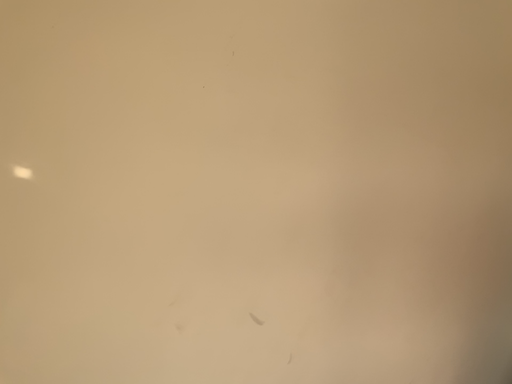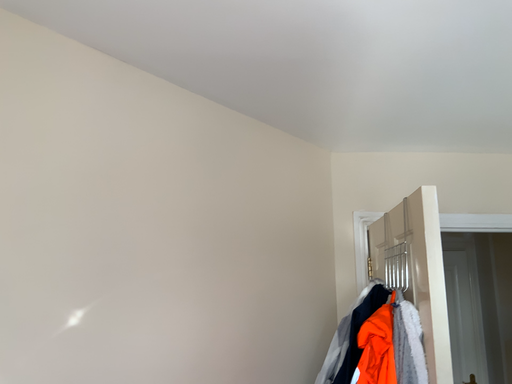
Question: How did the camera likely rotate when shooting the video?

Choices:
 (A) rotated downward
 (B) rotated upward

Answer: (B)